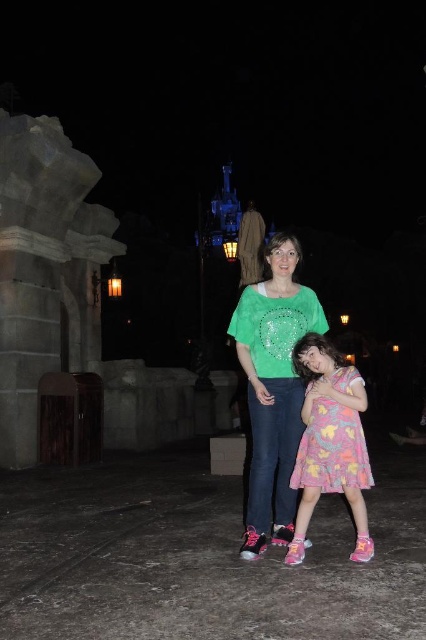
Question: Can you confirm if green glittery blouse at center is positioned to the left of pastel floral dress at center?

Choices:
 (A) yes
 (B) no

Answer: (A)

Question: Which object is closer to the camera taking this photo?

Choices:
 (A) green glittery blouse at center
 (B) pastel floral dress at center

Answer: (B)

Question: Is green glittery blouse at center positioned in front of pastel floral dress at center?

Choices:
 (A) no
 (B) yes

Answer: (A)

Question: Does green glittery blouse at center appear on the left side of pastel floral dress at center?

Choices:
 (A) yes
 (B) no

Answer: (A)

Question: Which of the following is the closest to the observer?

Choices:
 (A) green glittery blouse at center
 (B) pastel floral dress at center

Answer: (B)